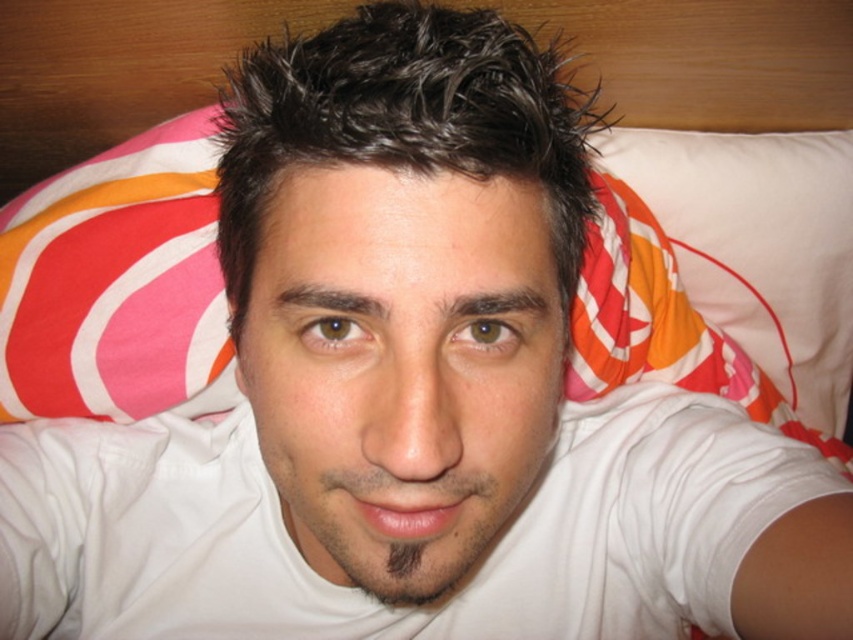
Question: Is white matte head at center to the left of white cotton shirt at center from the viewer's perspective?

Choices:
 (A) no
 (B) yes

Answer: (A)

Question: Does white matte head at center have a lesser width compared to white cotton shirt at center?

Choices:
 (A) yes
 (B) no

Answer: (A)

Question: Considering the relative positions of white matte head at center and white cotton shirt at center in the image provided, where is white matte head at center located with respect to white cotton shirt at center?

Choices:
 (A) left
 (B) right

Answer: (B)

Question: Which object appears farthest from the camera in this image?

Choices:
 (A) white cotton shirt at center
 (B) white matte head at center

Answer: (A)